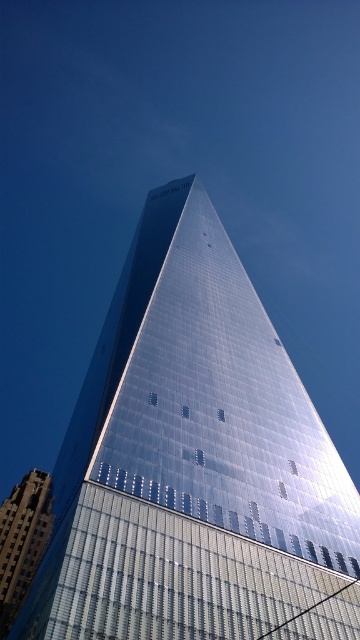
From the perspective of someone standing at the base of the dark brown brick building at lower left, which direction should they look to see the shiny glass skyscraper at center?

The shiny glass skyscraper at center is to the right of the dark brown brick building at lower left, so they should look to their right to see it.

You are standing on the street looking up at the shiny glass skyscraper at center and the dark brown brick building at lower left. Which building do you see extending higher into the sky?

The shiny glass skyscraper at center extends higher into the sky than the dark brown brick building at lower left because it is much taller.

You are an architect evaluating the spatial relationship between the shiny glass skyscraper at center and the dark brown brick building at lower left. Which building appears bigger in the image?

The shiny glass skyscraper at center appears bigger in the image as it has a larger size compared to the dark brown brick building at lower left.